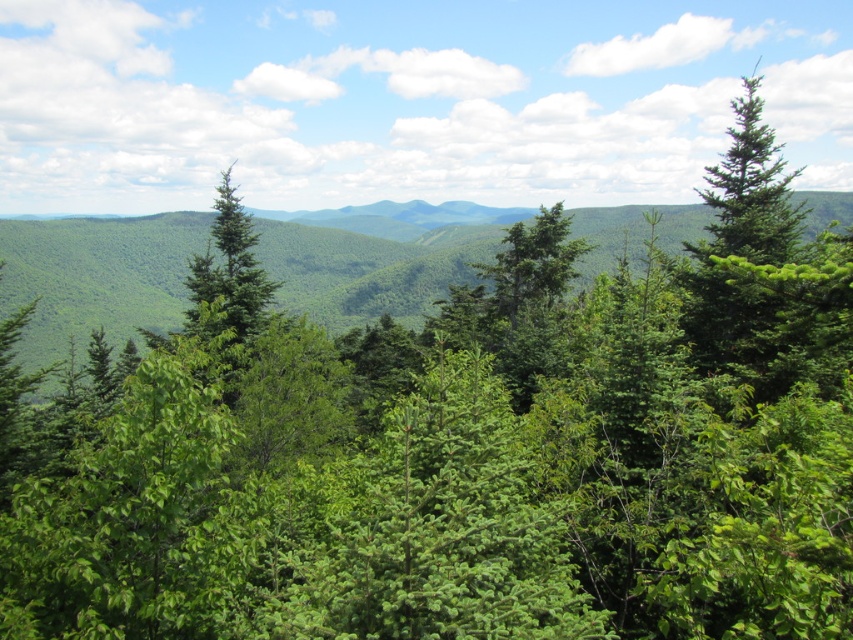
You are a hiker planning a route through the lush landscape. You need to decide whether to traverse the green leafy forest at center or the green leafy mountain at center first. Based on their positions, which one is located to the right side when viewed from your perspective?

The green leafy forest at center is positioned on the right side of the green leafy mountain at center, so you should go through the green leafy forest at center first if you want to take the right side route.

You are a hiker planning a route through the lush landscape shown in the image. You need to decide whether to traverse the green leafy forest at center or the green leafy mountain at center. Which option would require climbing over a taller terrain?

The green leafy mountain at center is taller than the green leafy forest at center, so traversing the green leafy mountain at center would require climbing over taller terrain.

From the picture: You are standing in the lush forest and want to reach the two points marked in the image. Which point, point (668, 532) or point (144, 220), is closer to you?

Point (668, 532) is closer to you than point (144, 220).